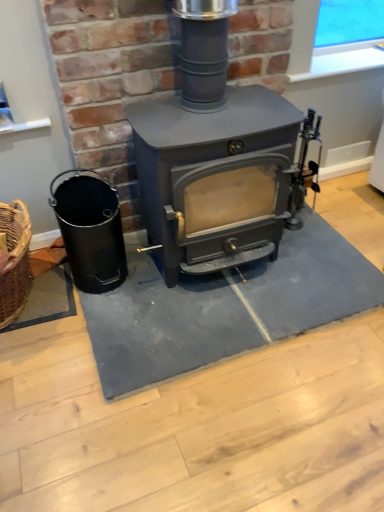
Question: In terms of size, does gray rubber doormat at center appear bigger or smaller than matte gray wood burning stove at center?

Choices:
 (A) big
 (B) small

Answer: (B)

Question: Is gray rubber doormat at center to the left or to the right of matte gray wood burning stove at center in the image?

Choices:
 (A) right
 (B) left

Answer: (A)

Question: Which object is positioned farthest from the matte gray wood burning stove at center?

Choices:
 (A) gray rubber doormat at center
 (B) black matte bucket at left

Answer: (A)

Question: Which of these objects is positioned closest to the matte gray wood burning stove at center?

Choices:
 (A) black matte bucket at left
 (B) gray rubber doormat at center

Answer: (A)